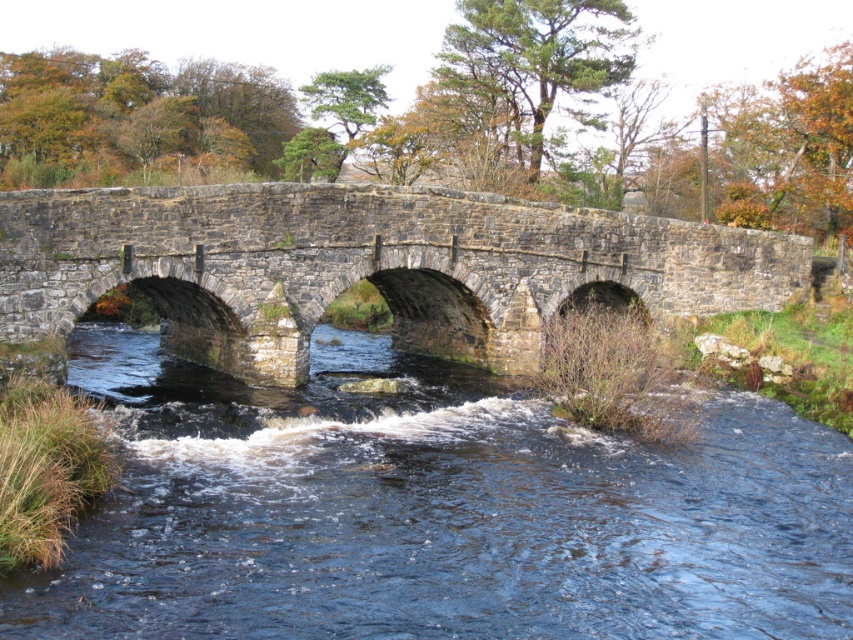
In the scene shown: You are standing on the stone bridge and want to walk towards the point that is closer to you. Which point should you head towards, point (340, 440) or point (529, 262)?

Point (340, 440) is in front of point (529, 262), so you should head towards point (340, 440) since it is closer to your current position on the bridge.

You are standing on the stone bridge and want to locate the dark blue water at center. According to the coordinates provided, where should you look relative to your position?

The dark blue water at center is located at coordinates point (434, 513), so you should look towards the lower middle area from your position on the bridge.

You are a hiker standing on the stone bridge at center. Looking down, you see the dark blue water at center. Which direction is the water flowing relative to the bridge?

The dark blue water at center is flowing underneath the stone bridge at center, but the direction of the water flow cannot be determined from the given information.